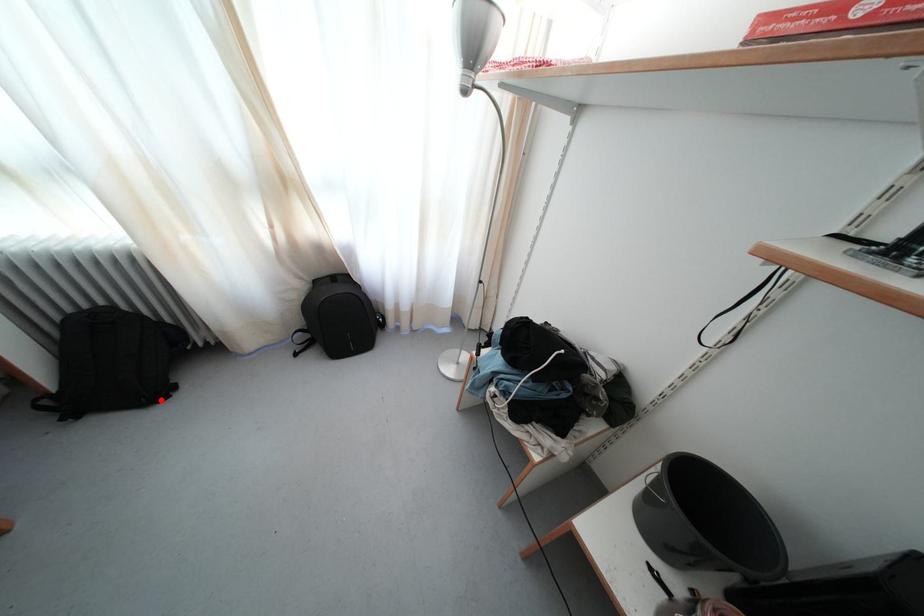
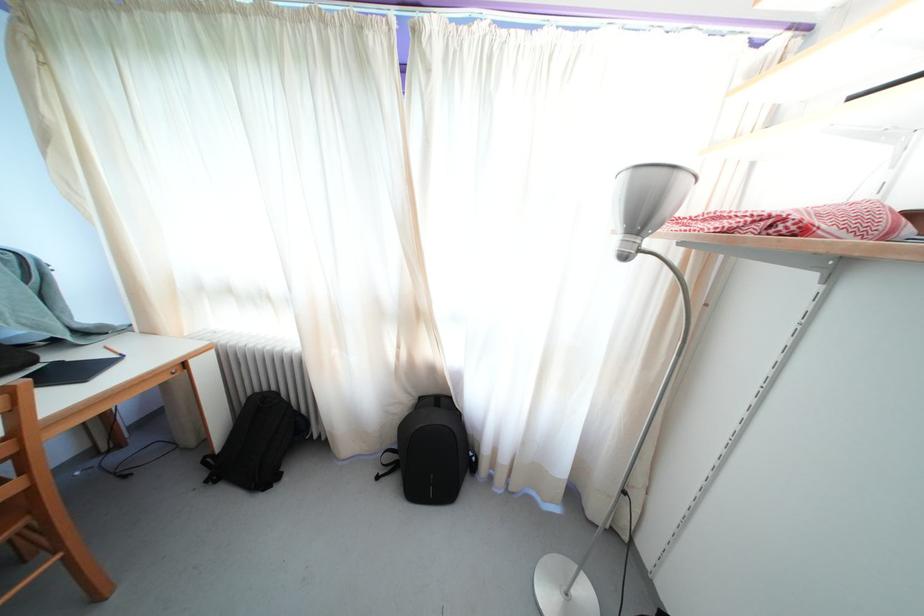
Question: A red point is marked in image1. In image2, is the corresponding 3D point closer to the camera or farther? Reply with the corresponding letter.

Choices:
 (A) The corresponding 3D point is closer.
 (B) The corresponding 3D point is farther.

Answer: (A)